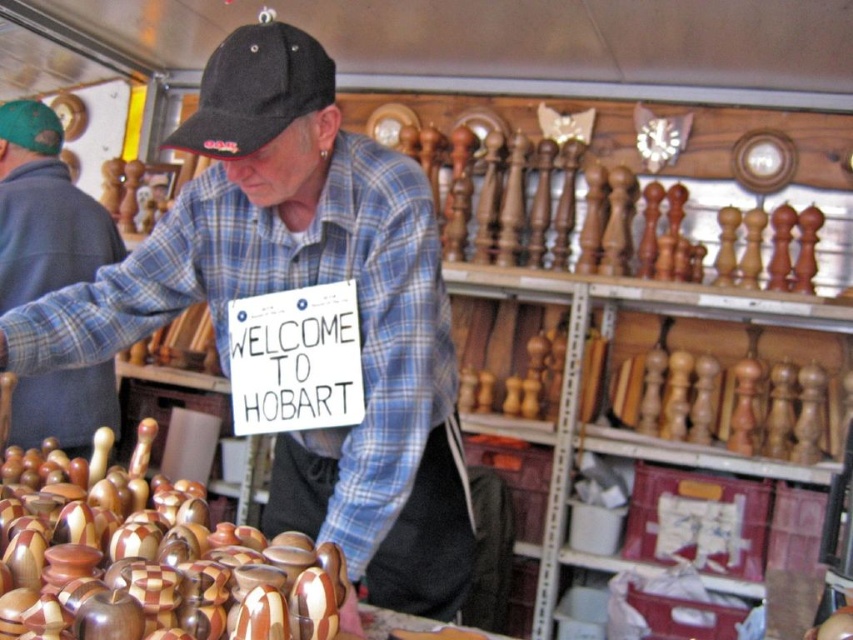
From the picture: Which is below, blue plaid shirt at center or matte black cap at upper left?

blue plaid shirt at center

Can you confirm if blue plaid shirt at center is positioned above matte black cap at upper left?

Actually, blue plaid shirt at center is below matte black cap at upper left.

Does point (393, 246) come closer to viewer compared to point (35, 397)?

That is True.

Where is `blue plaid shirt at center`? blue plaid shirt at center is located at coordinates (287, 289).

Can you confirm if matte black cap at upper left is thinner than black fabric baseball cap at upper center?

Incorrect, matte black cap at upper left's width is not less than black fabric baseball cap at upper center's.

Is point (44, 401) closer to camera compared to point (264, 54)?

No.

You are a GUI agent. You are given a task and a screenshot of the screen. Output one action in this format:
    pyautogui.click(x=<x>, y=<y>)
    Task: Click on the matte black cap at upper left
    
    Given the screenshot: What is the action you would take?
    pyautogui.click(x=44, y=211)

Who is shorter, blue plaid shirt at center or black fabric baseball cap at upper center?

black fabric baseball cap at upper center

Does blue plaid shirt at center have a greater width compared to black fabric baseball cap at upper center?

Yes, blue plaid shirt at center is wider than black fabric baseball cap at upper center.

Between point (380, 256) and point (329, 99), which one is positioned in front?

Point (329, 99) is in front.

Locate an element on the screen. This screenshot has height=640, width=853. blue plaid shirt at center is located at coordinates (287, 289).